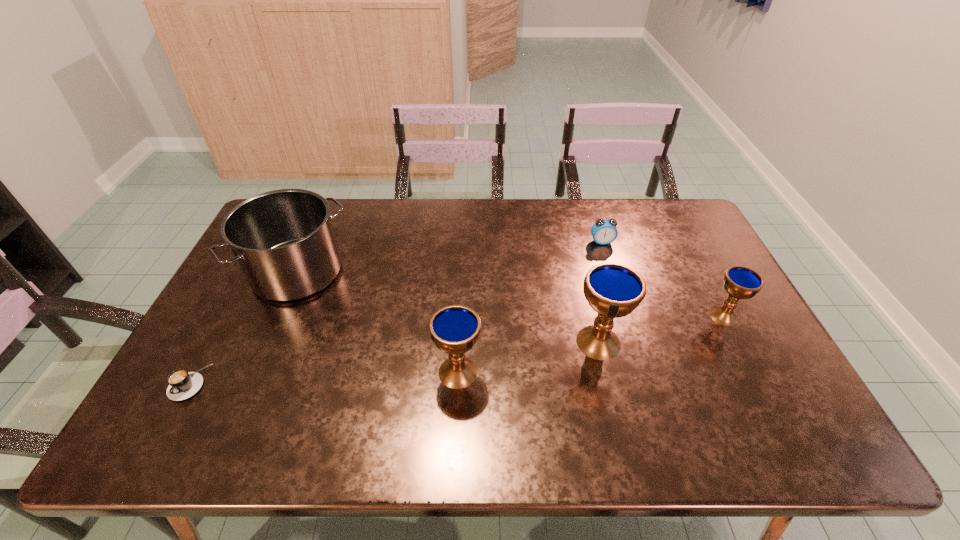
Where is `vacant spot to place a chalice on the left`? vacant spot to place a chalice on the left is located at coordinates (300, 406).